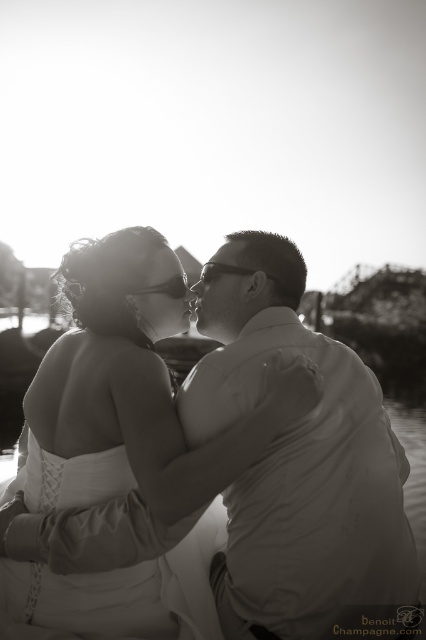
Question: Which object appears closest to the camera in this image?

Choices:
 (A) white satin dress at center
 (B) smooth skin forehead at center
 (C) smooth cotton shirt at right

Answer: (C)

Question: Can you confirm if white satin dress at center is smaller than smooth skin forehead at center?

Choices:
 (A) no
 (B) yes

Answer: (A)

Question: Among these points, which one is farthest from the camera?

Choices:
 (A) (299, 589)
 (B) (242, 433)
 (C) (218, 256)

Answer: (C)

Question: Among these objects, which one is nearest to the camera?

Choices:
 (A) white satin dress at center
 (B) smooth skin forehead at center

Answer: (A)

Question: Is smooth cotton shirt at right positioned in front of white satin dress at center?

Choices:
 (A) yes
 (B) no

Answer: (A)

Question: Is white satin dress at center behind smooth skin forehead at center?

Choices:
 (A) no
 (B) yes

Answer: (A)